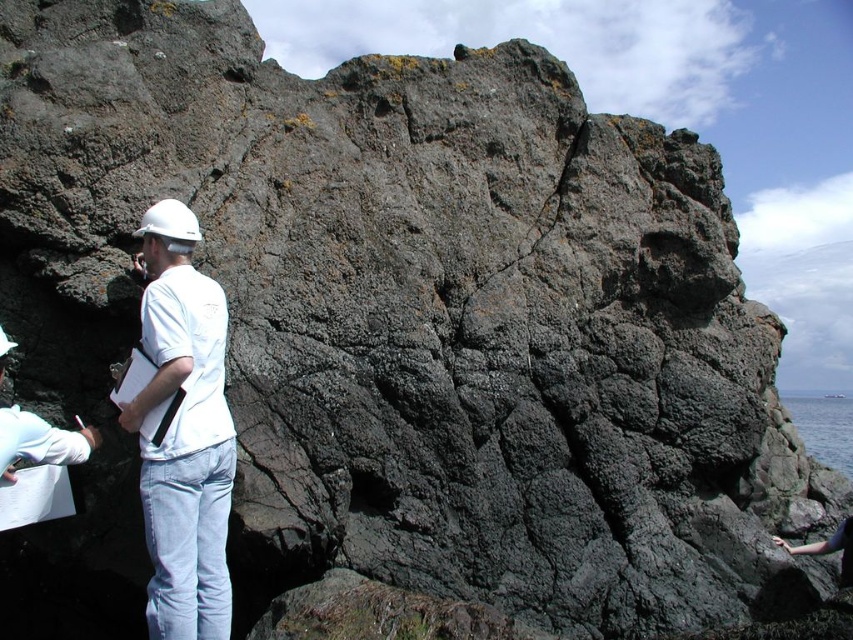
Between white matte hard hat at left and blue liquid water at lower right, which one appears on the right side from the viewer's perspective?

blue liquid water at lower right

The width and height of the screenshot is (853, 640). What are the coordinates of `white matte hard hat at left` in the screenshot? It's located at (39, 442).

You are a GUI agent. You are given a task and a screenshot of the screen. Output one action in this format:
    pyautogui.click(x=<x>, y=<y>)
    Task: Click on the white matte hard hat at left
    This screenshot has width=853, height=640.
    Given the screenshot: What is the action you would take?
    pyautogui.click(x=39, y=442)

In the scene shown: Can you confirm if white matte helmet at left is positioned above blue liquid water at lower right?

Correct, white matte helmet at left is located above blue liquid water at lower right.

Does white matte helmet at left have a smaller size compared to blue liquid water at lower right?

Indeed, white matte helmet at left has a smaller size compared to blue liquid water at lower right.

Does point (227, 314) come farther from viewer compared to point (804, 428)?

No, (227, 314) is closer to viewer.

Locate an element on the screen. white matte helmet at left is located at coordinates 183,433.

Which of these two, white matte helmet at left or white matte hard hat at left, stands taller?

Standing taller between the two is white matte helmet at left.

This screenshot has height=640, width=853. What are the coordinates of `white matte helmet at left` in the screenshot? It's located at (183, 433).

Who is more distant from viewer, (166, 349) or (15, 440)?

The point (166, 349) is behind.

Where is `white matte helmet at left`? The height and width of the screenshot is (640, 853). white matte helmet at left is located at coordinates (183, 433).